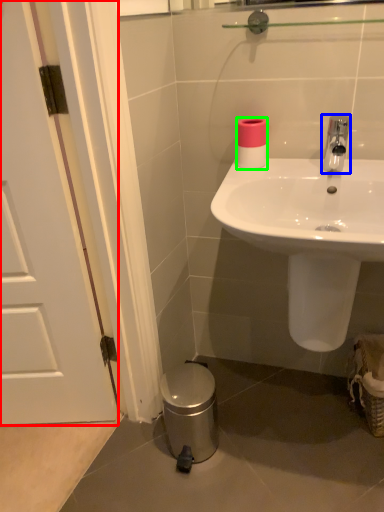
Question: Based on their relative distances, which object is nearer to door (highlighted by a red box)? Choose from tap (highlighted by a blue box) and toilet paper (highlighted by a green box).

Choices:
 (A) tap
 (B) toilet paper

Answer: (B)